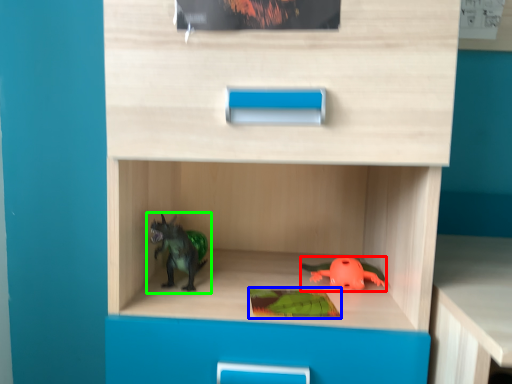
Question: Which is farther away from toy (highlighted by a red box)? paperback book (highlighted by a blue box) or toy (highlighted by a green box)?

Choices:
 (A) paperback book
 (B) toy

Answer: (B)